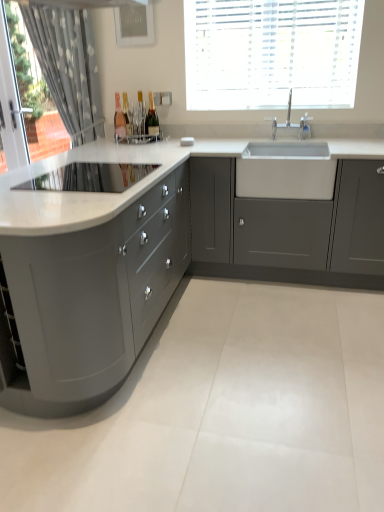
Question: Is gray fabric curtain at left shorter than clear glass bottle at center, which ranks as the first bottle in left-to-right order?

Choices:
 (A) no
 (B) yes

Answer: (A)

Question: Would you say gray fabric curtain at left is a long distance from clear glass bottle at center, which ranks as the first bottle in left-to-right order?

Choices:
 (A) no
 (B) yes

Answer: (A)

Question: Is gray fabric curtain at left outside of clear glass bottle at center, which ranks as the first bottle in left-to-right order?

Choices:
 (A) yes
 (B) no

Answer: (A)

Question: Considering the relative positions of gray fabric curtain at left and clear glass bottle at center, marked as the second bottle in a right-to-left arrangement, in the image provided, is gray fabric curtain at left in front of clear glass bottle at center, marked as the second bottle in a right-to-left arrangement,?

Choices:
 (A) no
 (B) yes

Answer: (B)

Question: From the image's perspective, is gray fabric curtain at left on clear glass bottle at center, marked as the second bottle in a right-to-left arrangement?

Choices:
 (A) yes
 (B) no

Answer: (A)

Question: Does gray fabric curtain at left contain clear glass bottle at center, marked as the second bottle in a right-to-left arrangement?

Choices:
 (A) yes
 (B) no

Answer: (B)

Question: Is matte gray cabinets at left, the 2th cabinetry viewed from the right, turned away from white ceramic tap at upper center?

Choices:
 (A) yes
 (B) no

Answer: (B)

Question: Can you confirm if matte gray cabinets at left, the 2th cabinetry viewed from the right, is taller than white ceramic tap at upper center?

Choices:
 (A) no
 (B) yes

Answer: (B)

Question: Considering the relative sizes of matte gray cabinets at left, which is the 1th cabinetry in left-to-right order, and white ceramic tap at upper center in the image provided, is matte gray cabinets at left, which is the 1th cabinetry in left-to-right order, bigger than white ceramic tap at upper center?

Choices:
 (A) no
 (B) yes

Answer: (B)

Question: From the image's perspective, would you say matte gray cabinets at left, the 2th cabinetry viewed from the right, is positioned over white ceramic tap at upper center?

Choices:
 (A) yes
 (B) no

Answer: (B)

Question: Is white ceramic tap at upper center surrounded by matte gray cabinets at left, which is the 1th cabinetry in left-to-right order?

Choices:
 (A) no
 (B) yes

Answer: (A)

Question: From a real-world perspective, is matte gray cabinets at left, which is the 1th cabinetry in left-to-right order, located beneath white ceramic tap at upper center?

Choices:
 (A) no
 (B) yes

Answer: (B)

Question: Considering the relative sizes of matte gray cabinet at center, marked as the first cabinetry in a right-to-left arrangement, and matte gray cabinets at left, which is the 1th cabinetry in left-to-right order, in the image provided, is matte gray cabinet at center, marked as the first cabinetry in a right-to-left arrangement, thinner than matte gray cabinets at left, which is the 1th cabinetry in left-to-right order,?

Choices:
 (A) yes
 (B) no

Answer: (A)